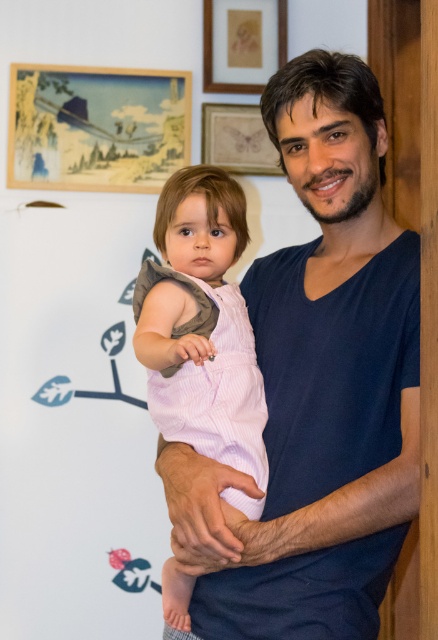
You are a photographer setting up a shoot in this room. You need to ensure that the pink striped overalls at center and the matte wooden picture frame at upper center are both visible in the shot. Given their sizes, which object might require you to adjust your camera angle to include it properly?

The pink striped overalls at center is bigger than the matte wooden picture frame at upper center, so the photographer might need to adjust the camera angle to ensure the larger pink striped overalls at center fits within the frame.

You are standing in the room where the man and child are. You want to place a small plant between the two points marked as point [173,209] and point [268,38]. Will the plant be closer to the man or the artwork on the wall?

The plant will be closer to the artwork on the wall because point [173,209] is in front of point [268,38], meaning the artwork is behind the man and the plant would be placed between them, closer to the artwork.